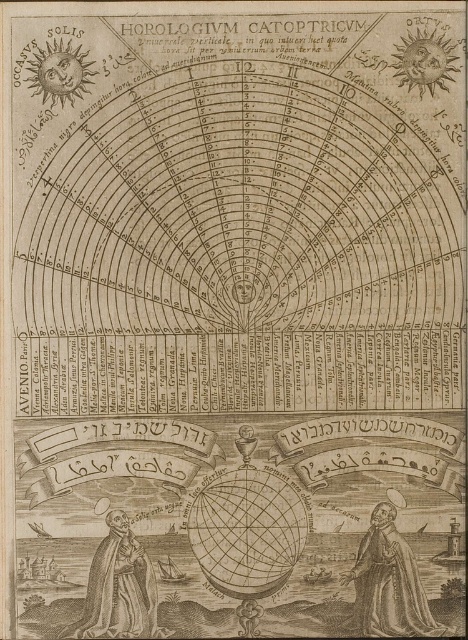
Question: Is smooth brown robe at lower right behind wooden statue at lower left?

Choices:
 (A) no
 (B) yes

Answer: (B)

Question: Is smooth brown robe at lower right positioned at the back of wooden statue at lower left?

Choices:
 (A) no
 (B) yes

Answer: (B)

Question: Which of the following is the farthest from the observer?

Choices:
 (A) smooth brown robe at lower right
 (B) wooden statue at lower left

Answer: (A)

Question: Does smooth brown robe at lower right come behind wooden statue at lower left?

Choices:
 (A) yes
 (B) no

Answer: (A)

Question: Which point is farther to the camera?

Choices:
 (A) wooden statue at lower left
 (B) smooth brown robe at lower right

Answer: (B)

Question: Which point is closer to the camera?

Choices:
 (A) smooth brown robe at lower right
 (B) wooden statue at lower left

Answer: (B)